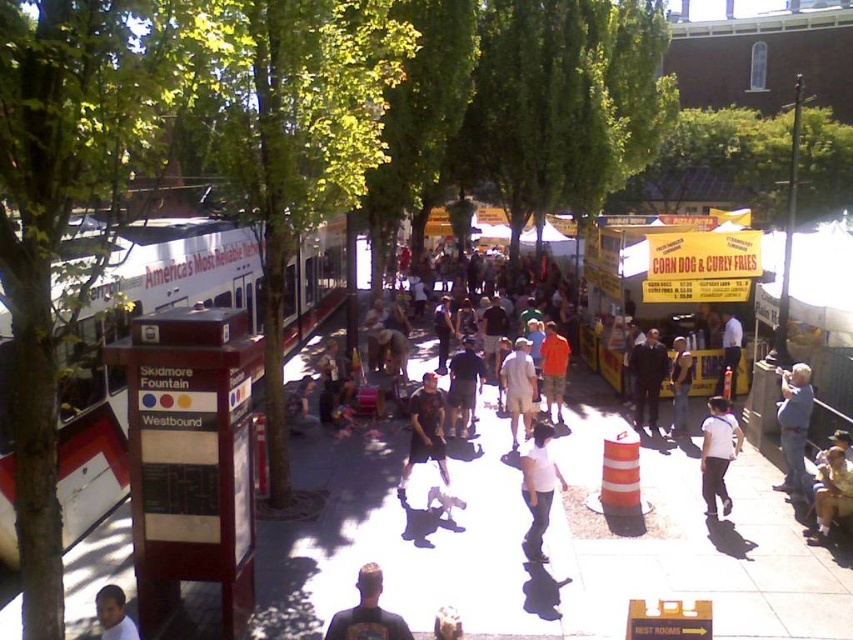
You are standing at the bus stop sign in front of the red and white bus labeled America Most Reliable Network. Looking towards the middle ground, you see a point marked at coordinates (367,612). What object or person is located at this point?

The point at coordinates (367,612) corresponds to the dark blue t shirt at center.